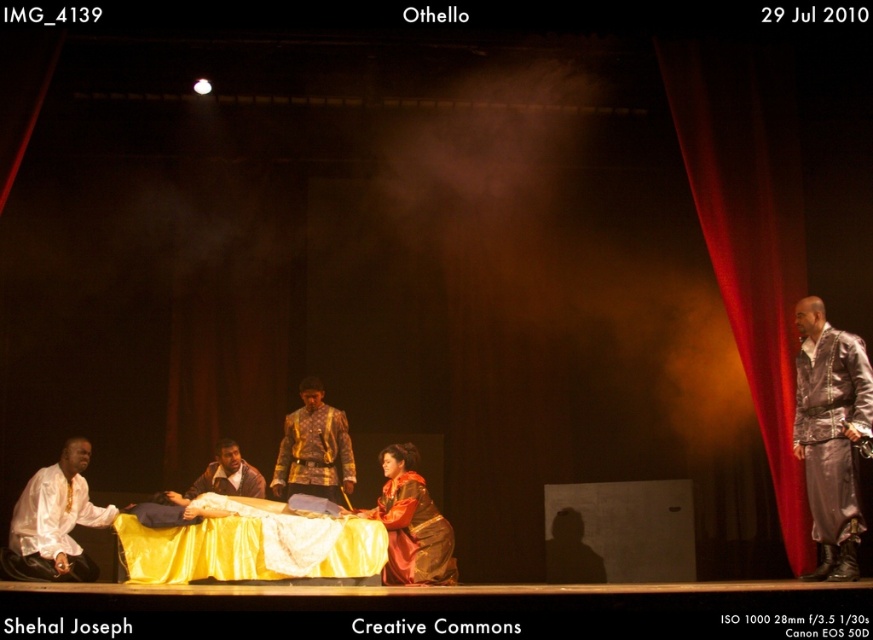
In the theatrical scene of Othello, there is a point marked at coordinates [411,524]. Which object from the list below is located at that point? The options are the bed with yellow and white cloth, the velvet red dress, or the red curtains.

The point at [411,524] corresponds to the velvet red dress at center, as stated in the Objects Description.

You are a stagehand operating a crane to lower a large prop onto the stage. The prop needs to be placed near the bed but must not come into contact with the red velvet curtain at right. Given that the crane can lower the prop within 5 meters of the curtain, is this possible?

The red velvet curtain at right is 5.73 meters away from the camera. Since the crane can lower the prop within 5 meters of the curtain, the distance is sufficient to avoid contact as 5.73 meters exceeds the 5 meter limit.